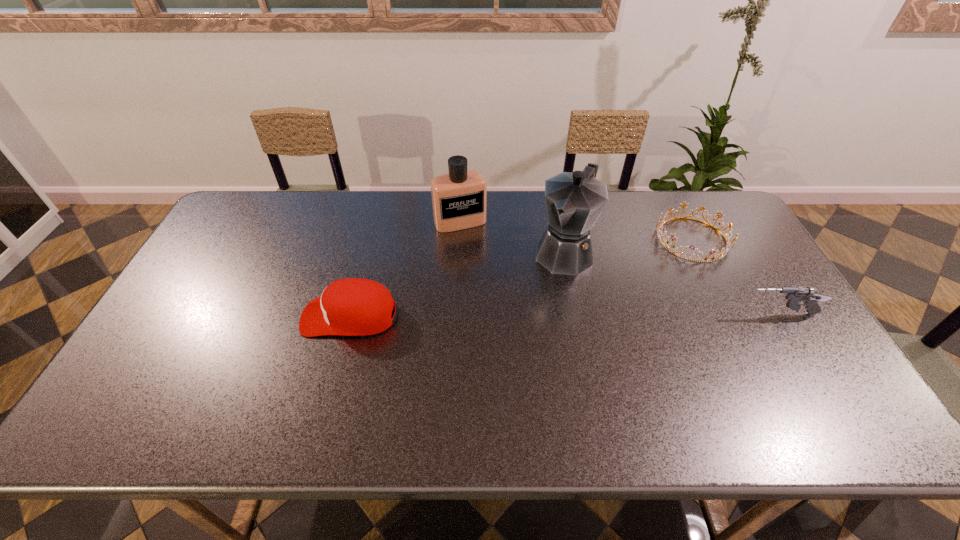
This screenshot has height=540, width=960. I want to click on object that is the second closest to the tallest object, so pyautogui.click(x=724, y=250).

In order to click on object that is the fourth closest to the gun in this screenshot , I will do `click(352, 306)`.

Find the location of a particular element. The image size is (960, 540). vacant space that satisfies the following two spatial constraints: 1. on the front side of the tiara; 2. on the left side of the second object from left to right is located at coordinates (459, 239).

In order to click on vacant space that satisfies the following two spatial constraints: 1. on the back side of the shortest object; 2. on the left side of the tallest object in this screenshot , I will do `click(562, 239)`.

At what (x,y) coordinates should I click in order to perform the action: click on free space in the image that satisfies the following two spatial constraints: 1. on the front side of the gun; 2. at the barrel of the perfume. Please return your answer as a coordinate pair (x, y). Looking at the image, I should click on (455, 315).